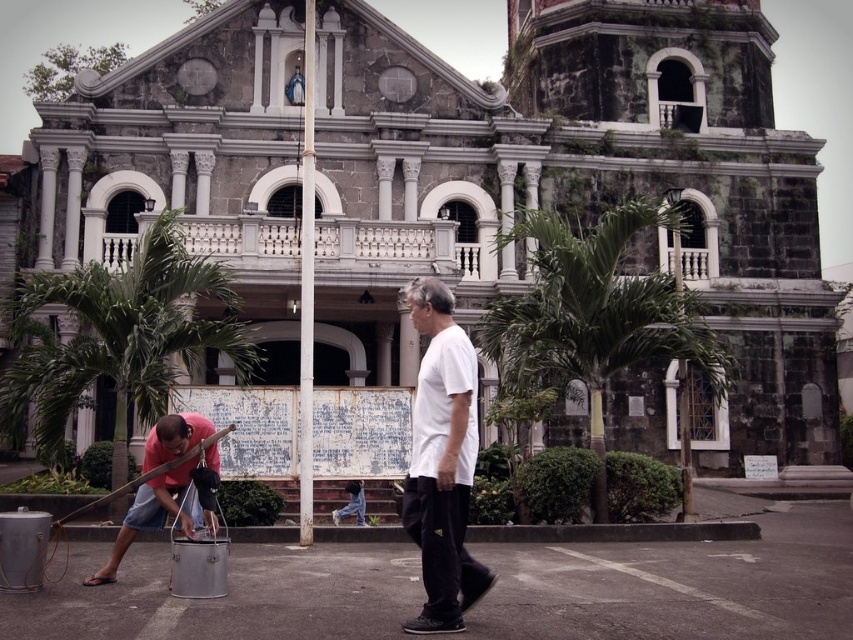
Looking at this image, you are a photographer at the historic stone church scene. You need to capture a photo where both the white matte shirt at center and the brushed metal bucket at lower left are visible. Given their sizes, which object will appear larger in the photo?

The white matte shirt at center will appear larger in the photo because it is bigger than the brushed metal bucket at lower left according to the description.